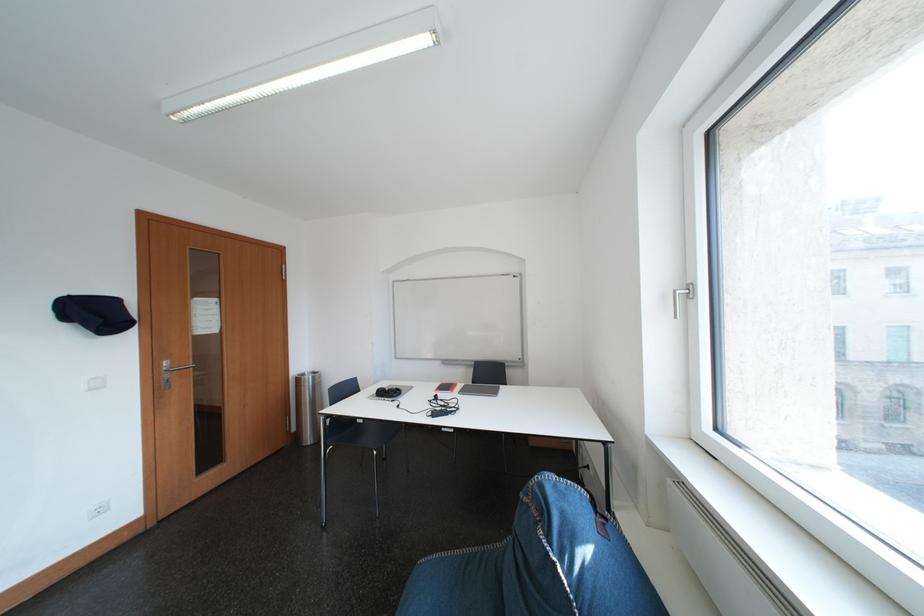
Image resolution: width=924 pixels, height=616 pixels. What do you see at coordinates (358, 439) in the screenshot? I see `a black chair sitting surface` at bounding box center [358, 439].